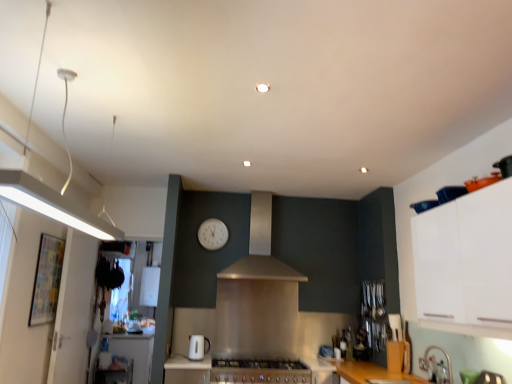
Question: In terms of width, does white glossy counter top at lower left look wider or thinner when compared to metallic stainless steel countertop at lower center?

Choices:
 (A) wide
 (B) thin

Answer: (A)

Question: In the image, is white glossy counter top at lower left on the left side or the right side of metallic stainless steel countertop at lower center?

Choices:
 (A) left
 (B) right

Answer: (A)

Question: Which object is the closest to the white glossy toaster at lower center?

Choices:
 (A) white matte cabinet at upper right
 (B) white glossy counter top at lower left
 (C) satin silver hood at center
 (D) metallic stainless steel countertop at lower center
 (E) white plastic clock at center

Answer: (D)

Question: Which is farther from the white glossy counter top at lower left?

Choices:
 (A) white glossy toaster at lower center
 (B) white plastic clock at center
 (C) white matte cabinet at upper right
 (D) satin silver hood at center
 (E) metallic stainless steel countertop at lower center

Answer: (C)